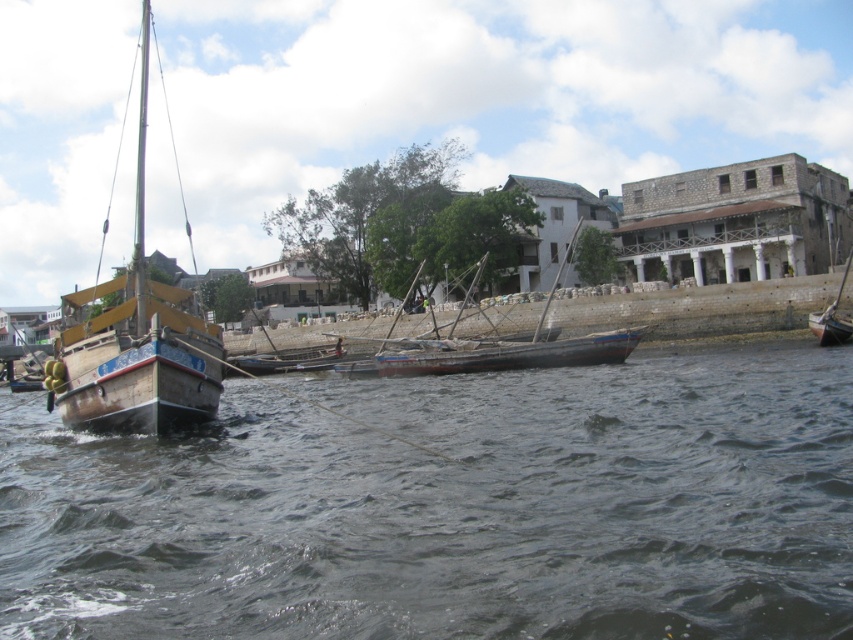
Question: Which object appears farthest from the camera in this image?

Choices:
 (A) wooden boat at right
 (B) wooden sailboat at left

Answer: (A)

Question: Which of the following is the closest to the observer?

Choices:
 (A) (215, 368)
 (B) (399, 362)

Answer: (A)

Question: Does wooden sailboat at left have a smaller size compared to wooden boat at center?

Choices:
 (A) yes
 (B) no

Answer: (B)

Question: Is dark gray water at center above wooden boat at right?

Choices:
 (A) yes
 (B) no

Answer: (B)

Question: Is dark gray water at center behind wooden boat at center?

Choices:
 (A) yes
 (B) no

Answer: (B)

Question: Which object appears farthest from the camera in this image?

Choices:
 (A) wooden boat at center
 (B) dark gray water at center

Answer: (A)